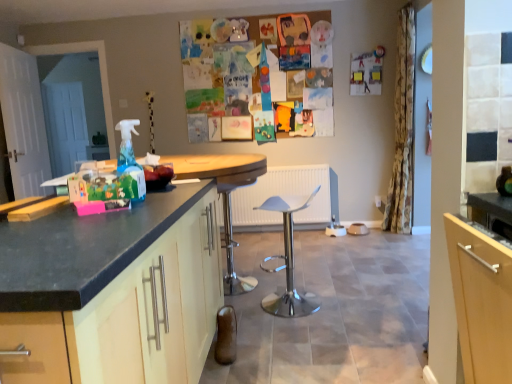
Question: Considering the relative sizes of matte wood cabinet at left and white glossy swivel chair at center in the image provided, is matte wood cabinet at left bigger than white glossy swivel chair at center?

Choices:
 (A) yes
 (B) no

Answer: (A)

Question: Could you tell me if matte wood cabinet at left is facing white glossy swivel chair at center?

Choices:
 (A) no
 (B) yes

Answer: (A)

Question: Is there a large distance between matte wood cabinet at left and white glossy swivel chair at center?

Choices:
 (A) no
 (B) yes

Answer: (B)

Question: Is matte wood cabinet at left facing away from white glossy swivel chair at center?

Choices:
 (A) yes
 (B) no

Answer: (B)

Question: Does matte wood cabinet at left have a lesser height compared to white glossy swivel chair at center?

Choices:
 (A) no
 (B) yes

Answer: (A)

Question: Considering the relative positions of white plastic stool at center and white wooden door at left in the image provided, is white plastic stool at center to the left or to the right of white wooden door at left?

Choices:
 (A) right
 (B) left

Answer: (A)

Question: In terms of width, does white plastic stool at center look wider or thinner when compared to white wooden door at left?

Choices:
 (A) thin
 (B) wide

Answer: (B)

Question: Is white plastic stool at center situated inside white wooden door at left or outside?

Choices:
 (A) outside
 (B) inside

Answer: (A)

Question: From a real-world perspective, relative to white wooden door at left, is white plastic stool at center vertically above or below?

Choices:
 (A) below
 (B) above

Answer: (A)

Question: Considering the positions of wooden round table at center and matte wood cabinet at left in the image, is wooden round table at center bigger or smaller than matte wood cabinet at left?

Choices:
 (A) big
 (B) small

Answer: (A)

Question: From the image's perspective, is wooden round table at center above or below matte wood cabinet at left?

Choices:
 (A) below
 (B) above

Answer: (B)

Question: In the image, is wooden round table at center on the left side or the right side of matte wood cabinet at left?

Choices:
 (A) left
 (B) right

Answer: (B)

Question: In terms of width, does wooden round table at center look wider or thinner when compared to matte wood cabinet at left?

Choices:
 (A) thin
 (B) wide

Answer: (B)

Question: Relative to white plastic stool at center, is wooden round table at center in front or behind?

Choices:
 (A) behind
 (B) front

Answer: (B)

Question: Considering the positions of point (257, 163) and point (232, 261), is point (257, 163) closer or farther from the camera than point (232, 261)?

Choices:
 (A) closer
 (B) farther

Answer: (A)